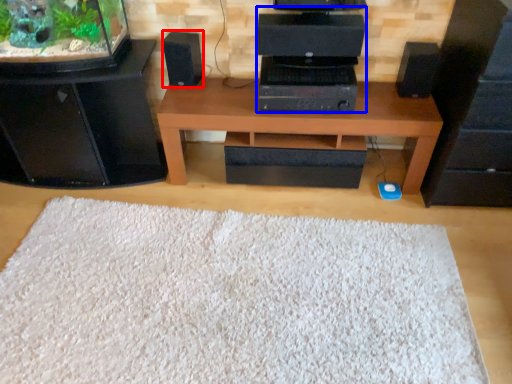
Question: Which point is closer to the camera, speaker (highlighted by a red box) or computer (highlighted by a blue box)?

Choices:
 (A) speaker
 (B) computer

Answer: (B)